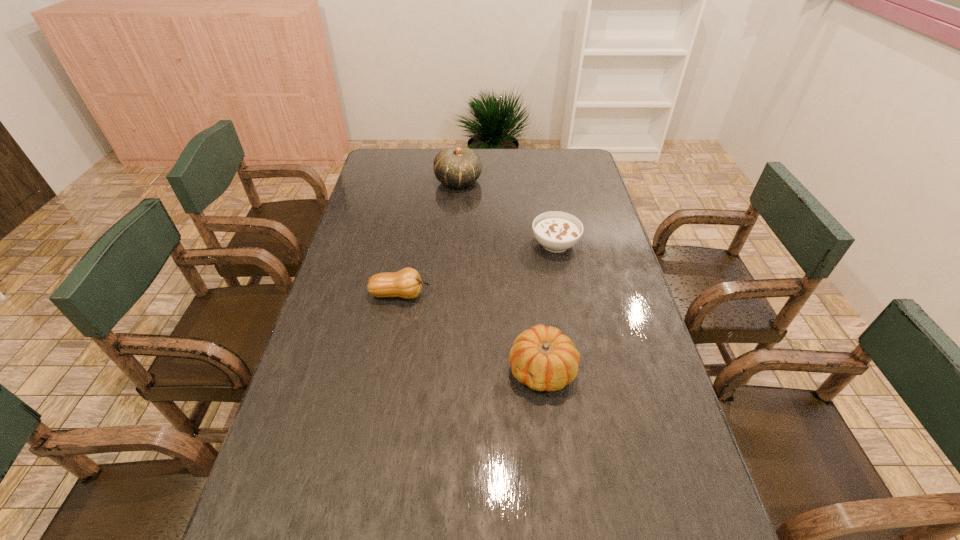
The image size is (960, 540). Find the location of `vacant area between the nearest object and the third farthest object`. vacant area between the nearest object and the third farthest object is located at coordinates (471, 332).

At what (x,y) coordinates should I click in order to perform the action: click on free space between the soup bowl and the tallest gourd. Please return your answer as a coordinate pair (x, y). Looking at the image, I should click on (507, 213).

This screenshot has width=960, height=540. I want to click on vacant area between the second shortest object and the nearest object, so click(x=471, y=332).

At what (x,y) coordinates should I click in order to perform the action: click on blank region between the rightmost gourd and the second nearest gourd. Please return your answer as a coordinate pair (x, y). Looking at the image, I should click on (471, 332).

I want to click on free spot between the third nearest object and the second nearest object, so click(478, 269).

Locate an element on the screen. free space between the nearest object and the tallest gourd is located at coordinates (500, 275).

Where is `vacant region between the shortest gourd and the tallest gourd`? vacant region between the shortest gourd and the tallest gourd is located at coordinates (429, 238).

The image size is (960, 540). Identify the location of vacant region between the second nearest gourd and the third nearest object. (478, 269).

Locate an element on the screen. free point between the tallest object and the soup bowl is located at coordinates (507, 213).

At what (x,y) coordinates should I click in order to perform the action: click on object that is the closest to the nearest object. Please return your answer as a coordinate pair (x, y). This screenshot has height=540, width=960. Looking at the image, I should click on (406, 283).